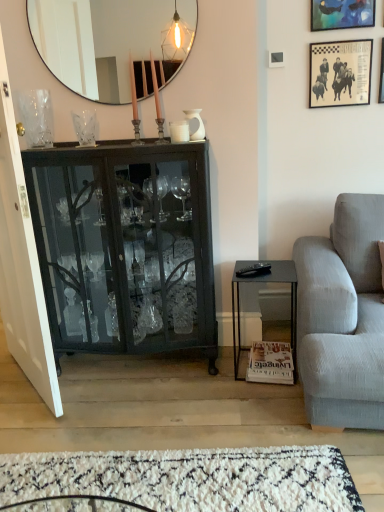
Find the location of a particular element. Image resolution: width=384 pixels, height=512 pixels. vacant area that is in front of black metal side table at lower right is located at coordinates pyautogui.click(x=260, y=400).